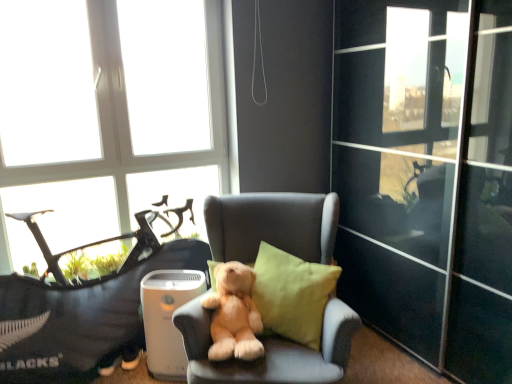
The image size is (512, 384). Describe the element at coordinates (234, 314) in the screenshot. I see `soft plush bear at center` at that location.

In order to face transparent glass window at upper left, should I rotate leftwards or rightwards?

Turn left approximately 17.592 degrees to face it.

In order to click on soft fabric teddy bear at center in this screenshot , I will do `click(82, 319)`.

Find the location of a particular element. Image resolution: width=512 pixels, height=384 pixels. linen cushion at center is located at coordinates (292, 294).

Where is `soft plush bear at center`? The image size is (512, 384). soft plush bear at center is located at coordinates (234, 314).

From a real-world perspective, relative to soft plush bear at center, is transparent glass window at upper left vertically above or below?

In terms of real-world spatial position, transparent glass window at upper left is above soft plush bear at center.

Which is behind, point (78, 125) or point (252, 322)?

The point (78, 125) is more distant.

Is transparent glass window at upper left outside of soft plush bear at center?

transparent glass window at upper left is positioned outside soft plush bear at center.

At what (x,y) coordinates should I click in order to perform the action: click on dog below the transparent glass window at upper left (from a real-world perspective). Please return your answer as a coordinate pair (x, y). The height and width of the screenshot is (384, 512). Looking at the image, I should click on (234, 314).

Is soft plush bear at center facing towards transparent glass window at upper left?

No.

Based on the photo, is transparent glass window at upper left located within soft plush bear at center?

Definitely not — transparent glass window at upper left is not inside soft plush bear at center.

In terms of size, does soft plush bear at center appear bigger or smaller than transparent glass window at upper left?

Clearly, soft plush bear at center is smaller in size than transparent glass window at upper left.

Could you tell me if soft fabric teddy bear at center is facing linen cushion at center?

Yes, soft fabric teddy bear at center is aimed at linen cushion at center.

Where is `furniture behind the linen cushion at center`? The width and height of the screenshot is (512, 384). furniture behind the linen cushion at center is located at coordinates (82, 319).

Which is nearer, (x=6, y=171) or (x=271, y=255)?

Positioned in front is point (x=271, y=255).

In the scene shown: Based on their sizes in the image, would you say transparent glass window at upper left is bigger or smaller than linen cushion at center?

In the image, transparent glass window at upper left appears to be larger than linen cushion at center.

Considering the sizes of transparent glass window at upper left and linen cushion at center in the image, is transparent glass window at upper left taller or shorter than linen cushion at center?

Considering their sizes, transparent glass window at upper left has more height than linen cushion at center.

Considering the relative positions of transparent glass window at upper left and linen cushion at center in the image provided, is transparent glass window at upper left to the right of linen cushion at center from the viewer's perspective?

In fact, transparent glass window at upper left is to the left of linen cushion at center.

Can you confirm if soft plush bear at center is smaller than linen cushion at center?

Correct, soft plush bear at center occupies less space than linen cushion at center.

Considering the relative sizes of soft plush bear at center and linen cushion at center in the image provided, is soft plush bear at center thinner than linen cushion at center?

No, soft plush bear at center is not thinner than linen cushion at center.

Is soft plush bear at center oriented towards linen cushion at center?

No.

Between soft plush bear at center and linen cushion at center, which one has less height?

soft plush bear at center is shorter.

Based on the photo, does soft fabric teddy bear at center come in front of transparent glass window at upper left?

Yes, soft fabric teddy bear at center is closer to the camera.

Could you tell me if soft fabric teddy bear at center is turned towards transparent glass window at upper left?

No, soft fabric teddy bear at center does not turn towards transparent glass window at upper left.

Can you confirm if soft fabric teddy bear at center is taller than transparent glass window at upper left?

No, soft fabric teddy bear at center is not taller than transparent glass window at upper left.

Is soft fabric teddy bear at center thinner than transparent glass window at upper left?

No, soft fabric teddy bear at center is not thinner than transparent glass window at upper left.

Does linen cushion at center appear on the left side of soft plush bear at center?

No.

From the image's perspective, is linen cushion at center under soft plush bear at center?

Actually, linen cushion at center appears above soft plush bear at center in the image.

Based on the photo, is soft plush bear at center inside linen cushion at center?

Definitely not — soft plush bear at center is not inside linen cushion at center.

Identify the location of window lying above the soft plush bear at center (from the image's perspective). (106, 117).

At what (x,y) coordinates should I click in order to perform the action: click on dog located on the right of transparent glass window at upper left. Please return your answer as a coordinate pair (x, y). The height and width of the screenshot is (384, 512). Looking at the image, I should click on (234, 314).

Considering their positions, is soft gray armchair at center positioned closer to soft fabric teddy bear at center than transparent glass window at upper left?

transparent glass window at upper left lies closer to soft fabric teddy bear at center than the other object.

From the picture: From the image, which object appears to be farther from linen cushion at center, soft gray armchair at center or transparent glass window at upper left?

Based on the image, transparent glass window at upper left appears to be further to linen cushion at center.

Which object lies further to the anchor point soft gray armchair at center, linen cushion at center or soft plush bear at center?

linen cushion at center is positioned further to the anchor soft gray armchair at center.

From the image, which object appears to be farther from soft plush bear at center, linen cushion at center or transparent glass window at upper left?

Based on the image, transparent glass window at upper left appears to be further to soft plush bear at center.

When comparing their distances from transparent glass window at upper left, does linen cushion at center or soft gray armchair at center seem further?

soft gray armchair at center.

Looking at the image, which one is located further to transparent glass window at upper left, soft gray armchair at center or soft fabric teddy bear at center?

soft gray armchair at center.

From the image, which object appears to be nearer to linen cushion at center, transparent glass window at upper left or soft fabric teddy bear at center?

The object closer to linen cushion at center is soft fabric teddy bear at center.

When comparing their distances from linen cushion at center, does soft plush bear at center or transparent glass window at upper left seem closer?

soft plush bear at center is closer to linen cushion at center.

This screenshot has height=384, width=512. Find the location of `dog between soft fabric teddy bear at center and linen cushion at center in the horizontal direction`. dog between soft fabric teddy bear at center and linen cushion at center in the horizontal direction is located at coordinates (234, 314).

Where is `furniture between transparent glass window at upper left and soft gray armchair at center in the vertical direction`? The width and height of the screenshot is (512, 384). furniture between transparent glass window at upper left and soft gray armchair at center in the vertical direction is located at coordinates (82, 319).

Locate an element on the screen. dog between transparent glass window at upper left and soft fabric teddy bear at center vertically is located at coordinates (234, 314).

This screenshot has height=384, width=512. Identify the location of chair situated between transparent glass window at upper left and linen cushion at center from left to right. (270, 351).